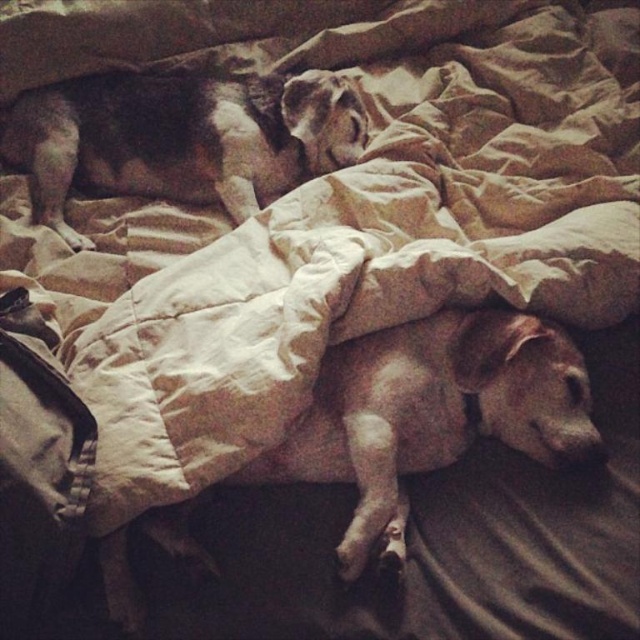
Does white smooth dog at lower right have a greater height compared to brown fur dog at upper left?

Correct, white smooth dog at lower right is much taller as brown fur dog at upper left.

Can you confirm if white smooth dog at lower right is positioned below brown fur dog at upper left?

Indeed, white smooth dog at lower right is positioned under brown fur dog at upper left.

Which is in front, point (496, 412) or point (49, 140)?

Point (496, 412)

Image resolution: width=640 pixels, height=640 pixels. I want to click on white smooth dog at lower right, so click(x=429, y=413).